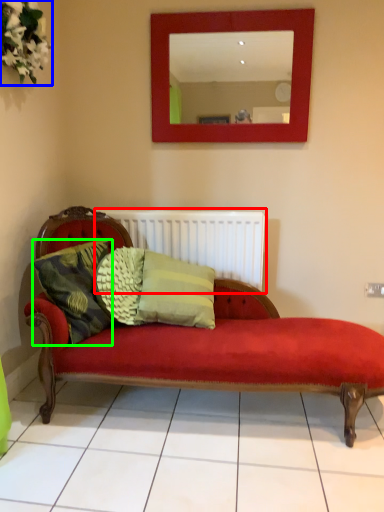
Question: Which object is positioned closest to radiator (highlighted by a red box)? Select from floral arrangement (highlighted by a blue box) and pillow (highlighted by a green box).

Choices:
 (A) floral arrangement
 (B) pillow

Answer: (B)